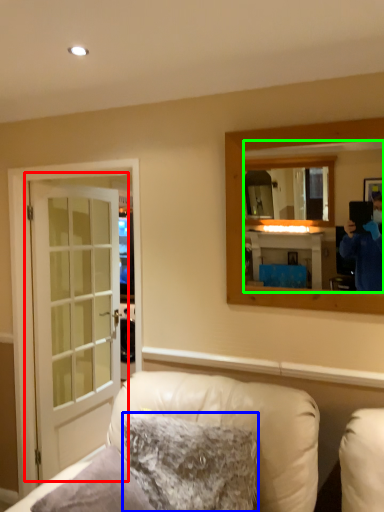
Question: Which object is positioned farthest from door (highlighted by a red box)? Select from pillow (highlighted by a blue box) and mirror (highlighted by a green box).

Choices:
 (A) pillow
 (B) mirror

Answer: (B)